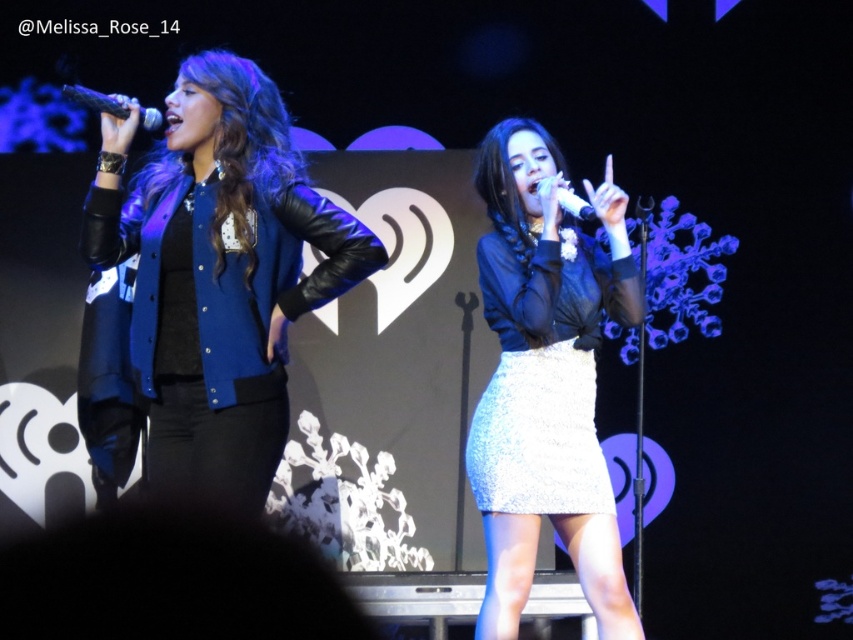
You are sitting in the front row of the concert hall and want to take a photo of both performers. The first performer is at point (244, 150) and the second performer is at point (514, 317). Which performer will appear larger in your photo?

The performer at point (244, 150) will appear larger in the photo because they are closer to the viewer than the performer at point (514, 317).

You are designing a stage costume for a new performance. You have two items to place in the wardrobe trunk. The matte blue leather jacket at left and the satin white skirt at center. If the trunk can only fit one of them, which item should you prioritize packing based on their sizes?

The matte blue leather jacket at left is larger than the satin white skirt at center, so you should prioritize packing the matte blue leather jacket at left since it takes up more space and needs to be accommodated first.

You are an event planner setting up a camera to capture the performance. The camera needs to focus on the satin white skirt at center. Based on its position, where should you aim the camera?

The satin white skirt at center is located at point (546, 380), so you should aim the camera at those coordinates to capture it properly.